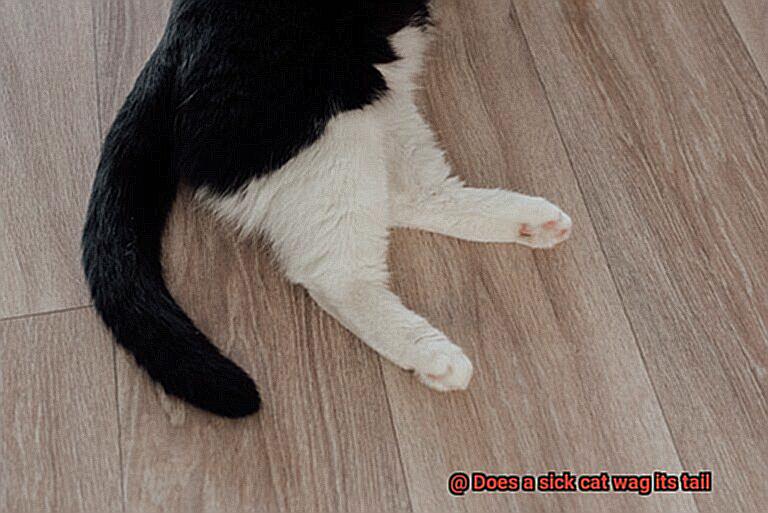
Find the location of a particular element. Image resolution: width=768 pixels, height=513 pixels. floor is located at coordinates 528,144.